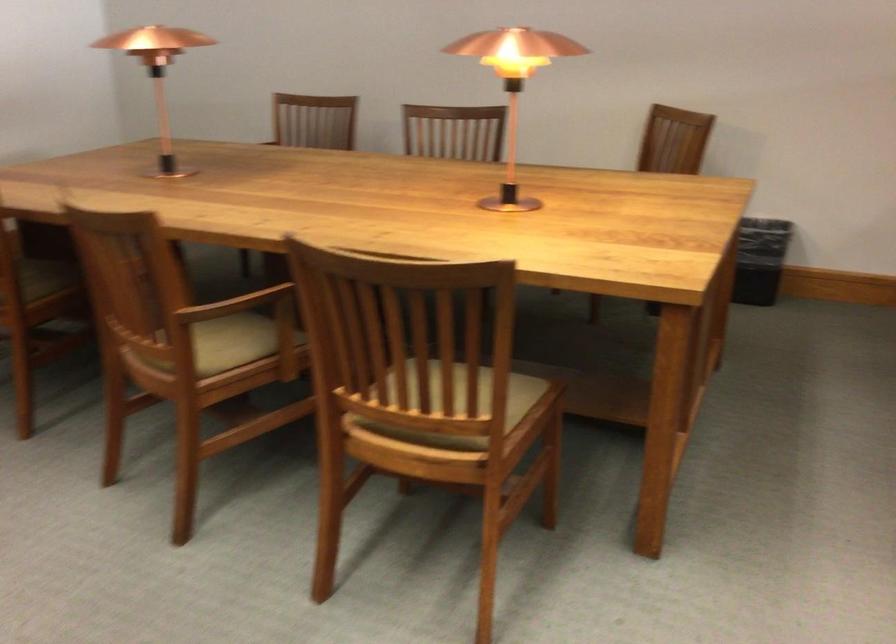
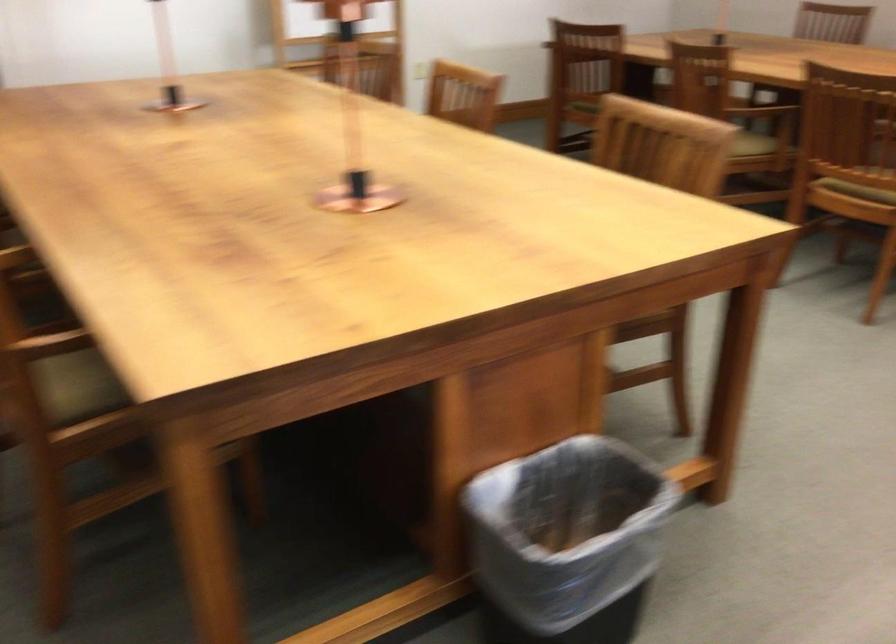
Question: I am providing you with two images of the same scene from different viewpoints. After the viewpoint changes to image2, which objects are now occluded?

Choices:
 (A) green chair sitting surface
 (B) grey striped lid
 (C) wooden chair armrest
 (D) wooden chair sitting surface

Answer: (C)